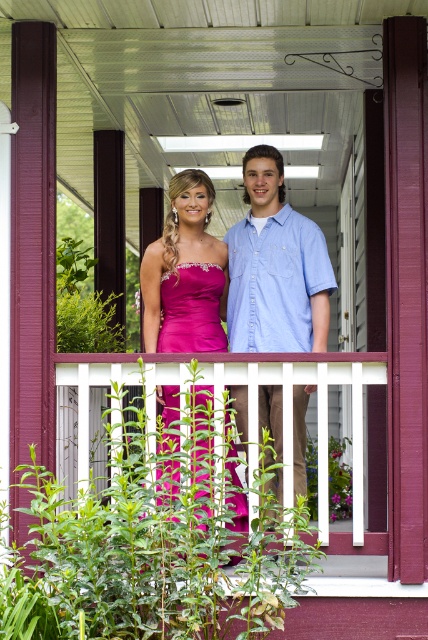
Identify the location of white wooden rail at center. (318, 419).

Does white wooden rail at center appear on the left side of shiny satin dress at center?

Incorrect, white wooden rail at center is not on the left side of shiny satin dress at center.

The image size is (428, 640). What do you see at coordinates (318, 419) in the screenshot? I see `white wooden rail at center` at bounding box center [318, 419].

Locate an element on the screen. This screenshot has height=640, width=428. white wooden rail at center is located at coordinates (318, 419).

Which is above, light blue denim shirt at center or shiny satin dress at center?

light blue denim shirt at center is higher up.

Who is more distant from viewer, (288,285) or (202,280)?

Point (288,285)

You are a GUI agent. You are given a task and a screenshot of the screen. Output one action in this format:
    pyautogui.click(x=<x>, y=<y>)
    Task: Click on the light blue denim shirt at center
    
    Given the screenshot: What is the action you would take?
    pyautogui.click(x=276, y=268)

Which is above, light blue denim shirt at center or white wooden rail at center?

Positioned higher is light blue denim shirt at center.

Which is in front, point (278, 188) or point (354, 513)?

Point (354, 513) is more forward.

Describe the element at coordinates (276, 268) in the screenshot. I see `light blue denim shirt at center` at that location.

Identify the location of light blue denim shirt at center. The image size is (428, 640). (276, 268).